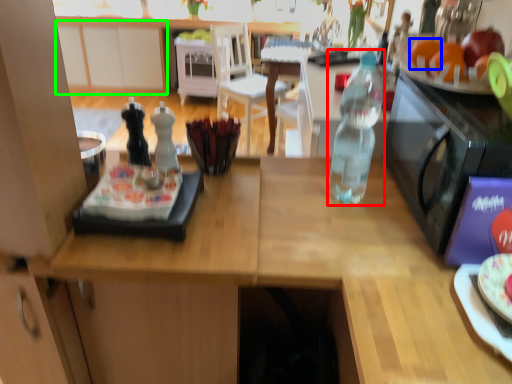
Question: Considering the real-world distances, which object is closest to bottle (highlighted by a red box)? orange (highlighted by a blue box) or cabinetry (highlighted by a green box).

Choices:
 (A) orange
 (B) cabinetry

Answer: (A)